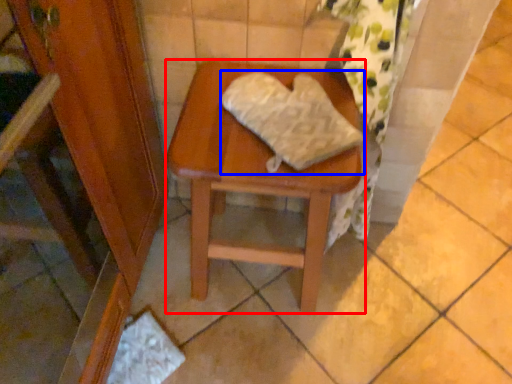
Question: Which point is further to the camera, stool (highlighted by a red box) or material (highlighted by a blue box)?

Choices:
 (A) stool
 (B) material

Answer: (A)